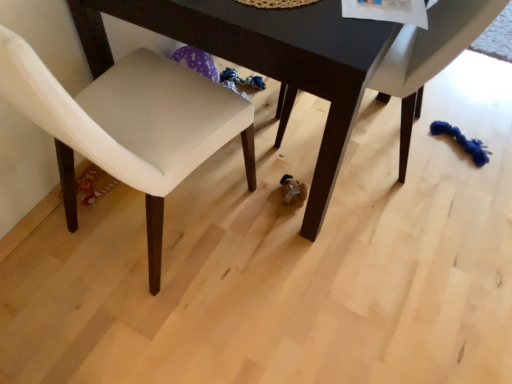
This screenshot has width=512, height=384. In order to click on vacant area that lies between white fabric chair at lower right, which is the 1th chair in right-to-left order, and dark wood table at center in this screenshot , I will do `click(368, 197)`.